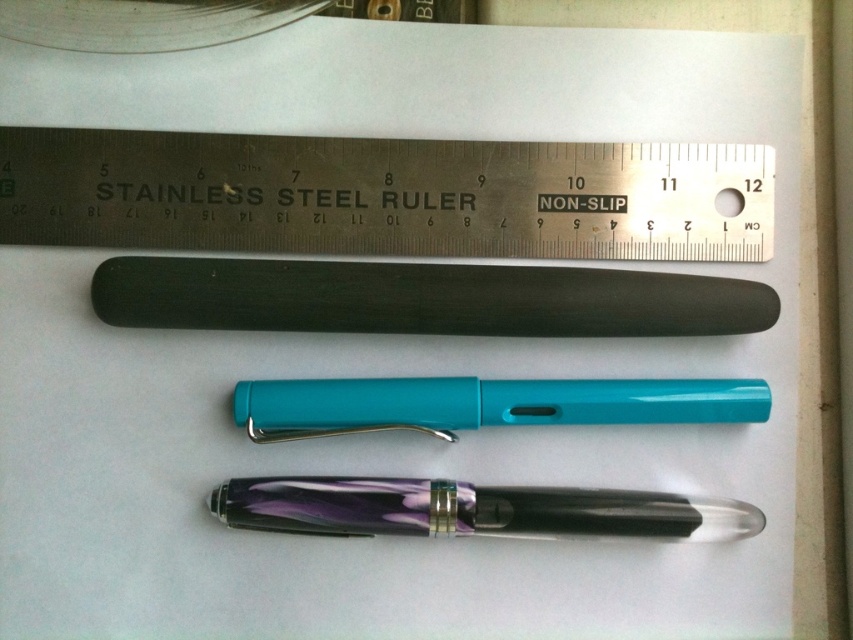
Question: Does stainless steel ruler at upper center appear over translucent purple pen at center?

Choices:
 (A) no
 (B) yes

Answer: (B)

Question: Can you confirm if translucent purple pen at center is positioned below teal glossy pen at center?

Choices:
 (A) yes
 (B) no

Answer: (A)

Question: Considering the real-world distances, which object is closest to the teal glossy pen at center?

Choices:
 (A) black rubberized pen at center
 (B) translucent purple pen at center

Answer: (A)

Question: Is the position of black rubberized pen at center less distant than that of teal glossy pen at center?

Choices:
 (A) yes
 (B) no

Answer: (A)

Question: Which is nearer to the stainless steel ruler at upper center?

Choices:
 (A) translucent purple pen at center
 (B) black rubberized pen at center

Answer: (B)

Question: Among these objects, which one is nearest to the camera?

Choices:
 (A) translucent purple pen at center
 (B) teal glossy pen at center
 (C) black rubberized pen at center
 (D) stainless steel ruler at upper center

Answer: (D)